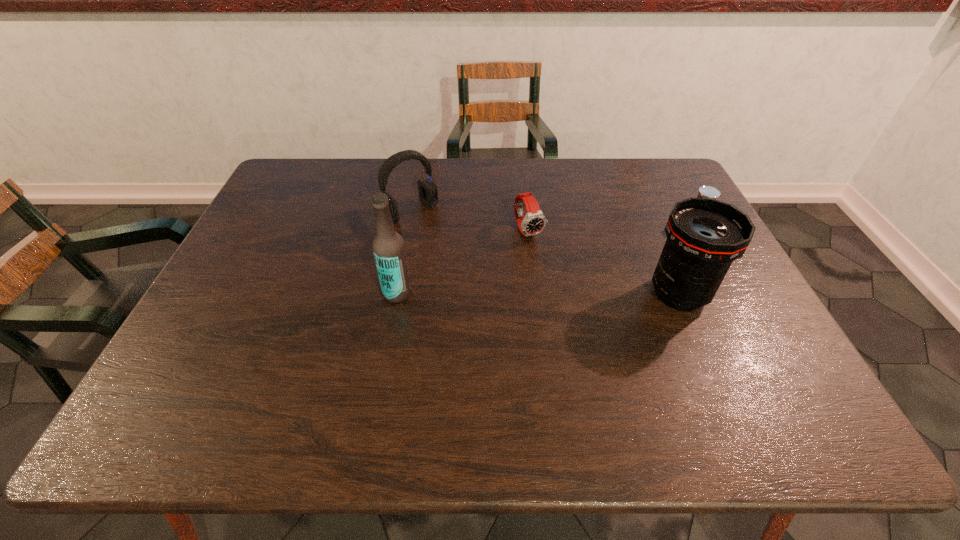
The height and width of the screenshot is (540, 960). What are the coordinates of `the tallest object` in the screenshot? It's located at point(388,246).

Where is `telephoto lens`? telephoto lens is located at coordinates (704, 236).

The height and width of the screenshot is (540, 960). Find the location of `the rightmost object`. the rightmost object is located at coordinates (705, 191).

Find the location of a particular element. the third object from left to right is located at coordinates (533, 223).

I want to click on headset, so tap(428, 190).

The width and height of the screenshot is (960, 540). I want to click on free location located on the side of the beer bottle with the label, so (x=327, y=293).

Identify the location of vacant space located 0.050m on the side of the beer bottle with the label. The image size is (960, 540). (363, 293).

Where is `free space located on the side of the beer bottle with the label`? free space located on the side of the beer bottle with the label is located at coordinates (327, 293).

I want to click on free space located 0.070m on the back of the second object from right to left, so click(x=661, y=253).

Where is `vacant space situated on the label side of the jam`? The width and height of the screenshot is (960, 540). vacant space situated on the label side of the jam is located at coordinates (648, 248).